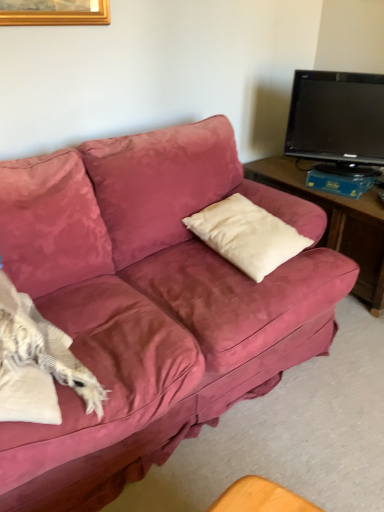
Question: Based on their positions, is black glossy tv at upper right located to the left or right of white soft cushion at center?

Choices:
 (A) left
 (B) right

Answer: (B)

Question: Is black glossy tv at upper right spatially inside white soft cushion at center, or outside of it?

Choices:
 (A) inside
 (B) outside

Answer: (B)

Question: From a real-world perspective, is black glossy tv at upper right physically located above or below white soft cushion at center?

Choices:
 (A) above
 (B) below

Answer: (A)

Question: Does point (256, 241) appear closer or farther from the camera than point (379, 173)?

Choices:
 (A) closer
 (B) farther

Answer: (A)

Question: In terms of size, does white soft cushion at center appear bigger or smaller than black glossy tv at upper right?

Choices:
 (A) small
 (B) big

Answer: (A)

Question: In terms of width, does white soft cushion at center look wider or thinner when compared to black glossy tv at upper right?

Choices:
 (A) thin
 (B) wide

Answer: (B)

Question: Is white soft cushion at center situated inside black glossy tv at upper right or outside?

Choices:
 (A) outside
 (B) inside

Answer: (A)